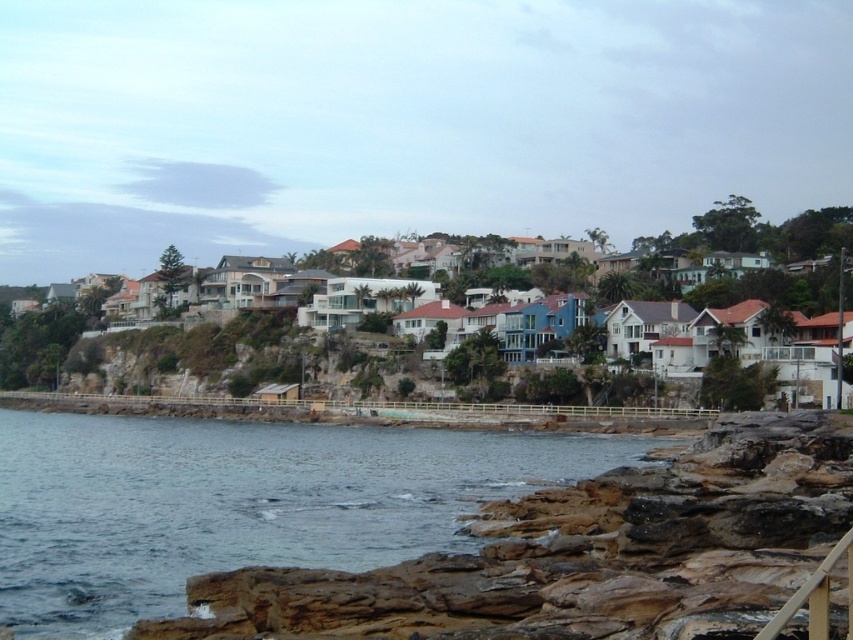
Can you confirm if blue water at lower left is bigger than white matte houses at center?

No, blue water at lower left is not bigger than white matte houses at center.

How much distance is there between blue water at lower left and white matte houses at center?

blue water at lower left is 60.86 meters away from white matte houses at center.

Image resolution: width=853 pixels, height=640 pixels. I want to click on blue water at lower left, so click(x=241, y=502).